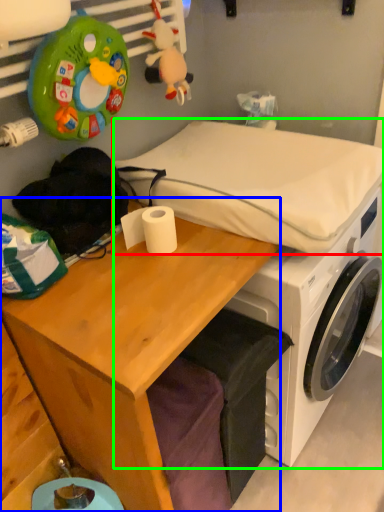
Question: Which object is the closest to the mattress (highlighted by a red box)? Choose among these: desk (highlighted by a blue box) or machine (highlighted by a green box).

Choices:
 (A) desk
 (B) machine

Answer: (B)